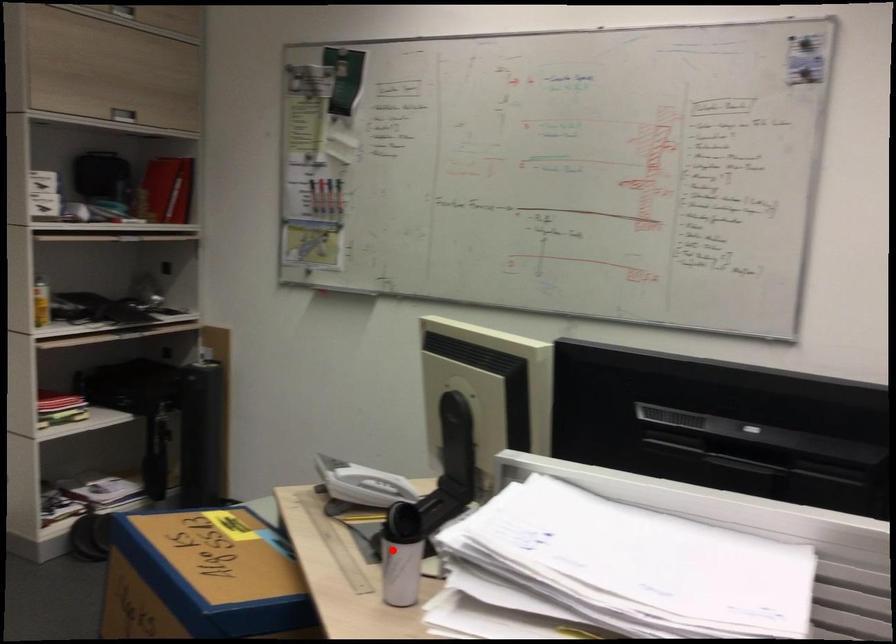
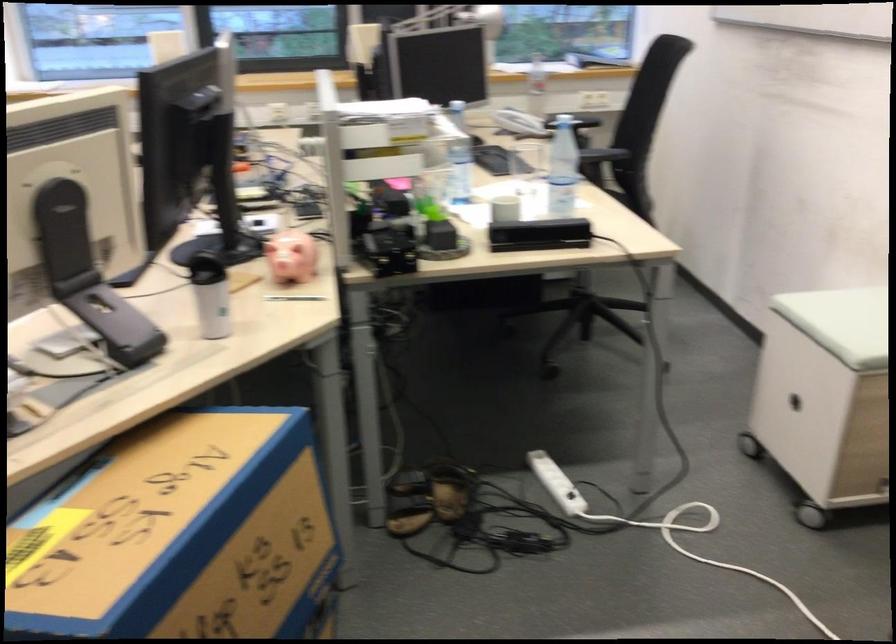
Question: I am providing you with two images of the same scene from different viewpoints. Given a red point in image1, look at the same physical point in image2. Is it:

Choices:
 (A) Closer to the viewpoint
 (B) Farther from the viewpoint

Answer: (B)